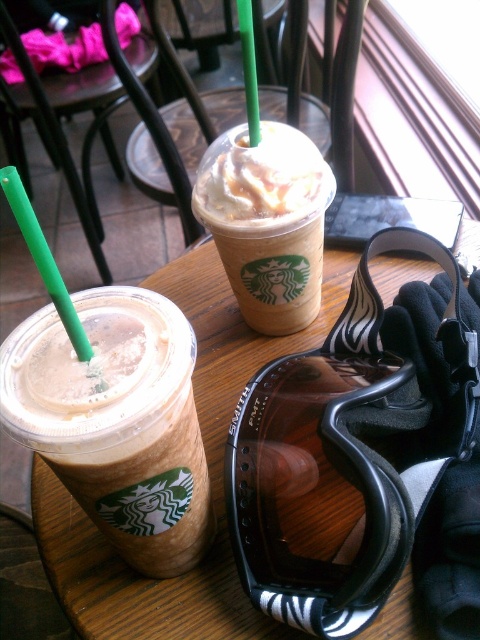
You are a barista who needs to place a new drink order on the table. The customer specified that the drink should be placed exactly 3 inches away from the green plastic straw at upper left. Is the current placement of the iced caramel macchiato at center meeting this requirement?

The distance between the iced caramel macchiato at center and the green plastic straw at upper left is 3.09 inches, which is slightly more than 3 inches. Therefore, the placement is not exactly meeting the customer requirement of 3 inches. The drink is placed 0.09 inches further away than specified.

You are a customer at the Starbucks counter. You want to place your phone on the wooden table at center so that it is higher than the green plastic straw at upper left. Is this possible?

The wooden table at center has a greater height compared to green plastic straw at upper left, so placing the phone on the wooden table at center will indeed be higher than the green plastic straw at upper left.